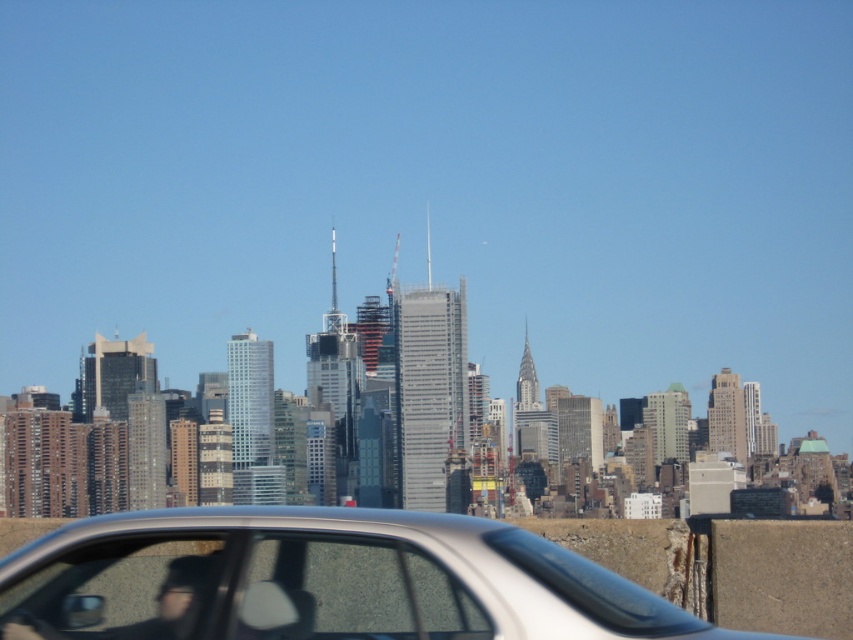
Is silver metallic car at center to the left of transparent glass car window at center from the viewer's perspective?

No, silver metallic car at center is not to the left of transparent glass car window at center.

Is silver metallic car at center positioned in front of transparent glass car window at center?

That is False.

You are a GUI agent. You are given a task and a screenshot of the screen. Output one action in this format:
    pyautogui.click(x=<x>, y=<y>)
    Task: Click on the silver metallic car at center
    The image size is (853, 640).
    Given the screenshot: What is the action you would take?
    pyautogui.click(x=322, y=580)

Does point (596, 602) lie in front of point (184, 572)?

That is False.

Between point (154, 576) and point (169, 630), which one is positioned in front?

Positioned in front is point (169, 630).

The image size is (853, 640). Identify the location of silver metallic car at center. (322, 580).

How much distance is there between transparent glass car window at center and transparent glass car window at lower left?

transparent glass car window at center and transparent glass car window at lower left are 37.26 meters apart from each other.

Does point (305, 548) come farther from viewer compared to point (36, 600)?

No, it is not.

The image size is (853, 640). Find the location of `transparent glass car window at center`. transparent glass car window at center is located at coordinates (350, 592).